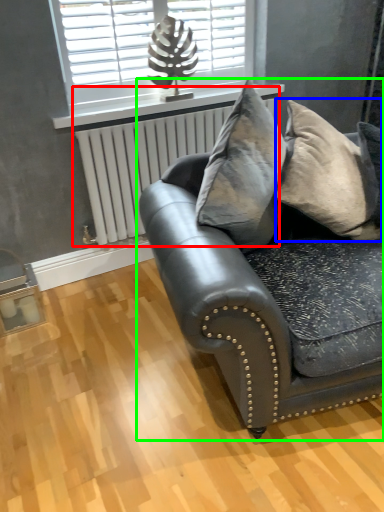
Question: Which object is the closest to the radiator (highlighted by a red box)? Choose among these: pillow (highlighted by a blue box) or studio couch (highlighted by a green box).

Choices:
 (A) pillow
 (B) studio couch

Answer: (B)